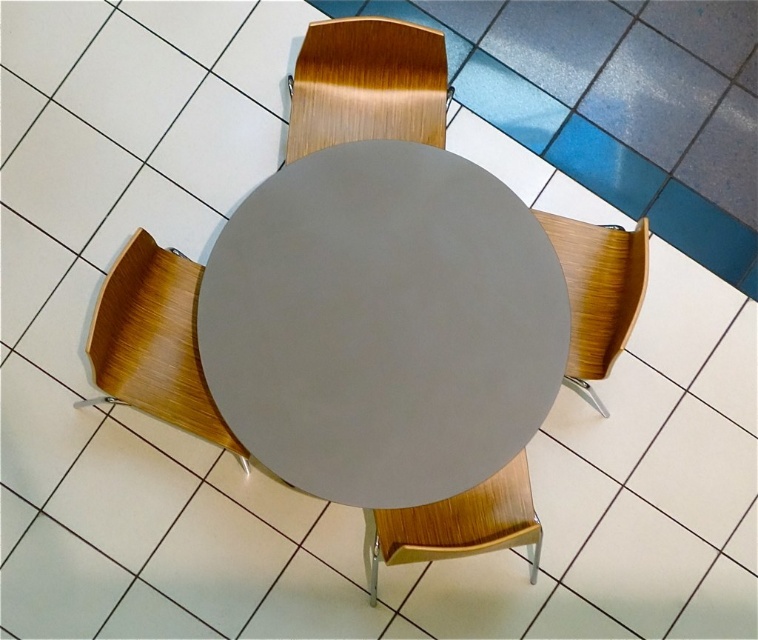
You are standing at the origin point of the coordinate system in the image. The origin is at the bottom left corner of the image. You want to place a new chair exactly at the same position as the matte gray table at center. What coordinates should you input into the placement tool to achieve this?

The coordinates to place the new chair exactly at the same position as the matte gray table at center are point (381, 324).

Looking at this image, you are sitting at the wooden chair at lower left and want to get up to leave. Which direction should you face to walk directly away from the wooden chair at bottom?

You should face the direction opposite to the wooden chair at bottom. Since the wooden chair at bottom is behind the wooden chair at lower left, facing away from it would mean turning towards the front, which is the direction opposite to where the wooden chair at bottom is located.